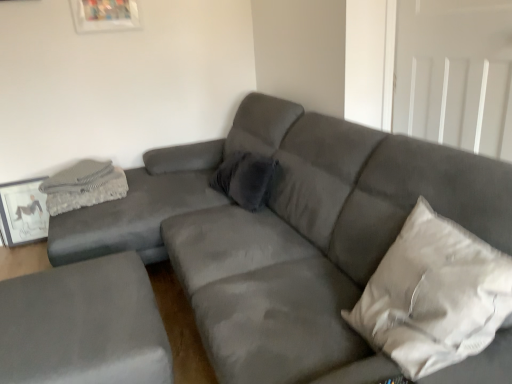
What is the approximate width of gray textured blanket at upper left?

20.87 inches.

Where is `matte gray picture frame at left`? matte gray picture frame at left is located at coordinates (23, 212).

Identify the location of white fabric pillow at right, the first pillow when ordered from right to left. The height and width of the screenshot is (384, 512). (434, 295).

Describe the element at coordinates (83, 325) in the screenshot. I see `suede gray ottoman at lower left, the 1th studio couch viewed from the left` at that location.

I want to click on gray textured blanket at upper left, so click(x=84, y=186).

Which is more to the left, matte gray picture frame at left or gray textured blanket at upper left?

matte gray picture frame at left.

Can you confirm if matte gray picture frame at left is taller than gray textured blanket at upper left?

Indeed, matte gray picture frame at left has a greater height compared to gray textured blanket at upper left.

Is matte gray picture frame at left located outside gray textured blanket at upper left?

Yes, matte gray picture frame at left is not within gray textured blanket at upper left.

How many degrees apart are the facing directions of matte gray picture frame at left and gray textured blanket at upper left?

matte gray picture frame at left and gray textured blanket at upper left are facing 90.4 degrees away from each other.

Is suede gray couch at center, the second studio couch when ordered from left to right, next to velvet gray pillow at center, positioned as the second pillow in front-to-back order?

No, suede gray couch at center, the second studio couch when ordered from left to right, is not making contact with velvet gray pillow at center, positioned as the second pillow in front-to-back order.

Locate an element on the screen. the 2nd studio couch in front of the velvet gray pillow at center, the first pillow in the back-to-front sequence is located at coordinates (287, 234).

Can you confirm if suede gray couch at center, positioned as the first studio couch in right-to-left order, is wider than velvet gray pillow at center, the first pillow from the left?

Yes.

Is point (120, 188) more distant than point (47, 220)?

No, (120, 188) is closer to viewer.

Is gray textured blanket at upper left situated inside matte gray picture frame at left or outside?

gray textured blanket at upper left is spatially situated outside matte gray picture frame at left.

Where is `picture frame that is on the left side of gray textured blanket at upper left`? picture frame that is on the left side of gray textured blanket at upper left is located at coordinates (23, 212).

Relative to suede gray ottoman at lower left, the 1th studio couch viewed from the left, is white fabric pillow at right, the first pillow when ordered from right to left, in front or behind?

Clearly, white fabric pillow at right, the first pillow when ordered from right to left, is in front of suede gray ottoman at lower left, the 1th studio couch viewed from the left.

How much distance is there between white fabric pillow at right, the 1th pillow from the front, and suede gray ottoman at lower left, the 1th studio couch viewed from the left?

white fabric pillow at right, the 1th pillow from the front, and suede gray ottoman at lower left, the 1th studio couch viewed from the left, are 36.00 inches apart.

From the image's perspective, is white fabric pillow at right, the 1th pillow from the front, above suede gray ottoman at lower left, the 1th studio couch viewed from the left?

Yes, from the image's perspective, white fabric pillow at right, the 1th pillow from the front, is above suede gray ottoman at lower left, the 1th studio couch viewed from the left.

Considering the sizes of white fabric pillow at right, the 2th pillow from the left, and suede gray ottoman at lower left, marked as the 2th studio couch in a right-to-left arrangement, in the image, is white fabric pillow at right, the 2th pillow from the left, wider or thinner than suede gray ottoman at lower left, marked as the 2th studio couch in a right-to-left arrangement,?

Clearly, white fabric pillow at right, the 2th pillow from the left, has less width compared to suede gray ottoman at lower left, marked as the 2th studio couch in a right-to-left arrangement.

In the image, is suede gray ottoman at lower left, the 1th studio couch viewed from the left, on the left side or the right side of suede gray couch at center, the second studio couch when ordered from left to right?

Clearly, suede gray ottoman at lower left, the 1th studio couch viewed from the left, is on the left of suede gray couch at center, the second studio couch when ordered from left to right, in the image.

Considering the sizes of suede gray ottoman at lower left, the 1th studio couch viewed from the left, and suede gray couch at center, positioned as the first studio couch in right-to-left order, in the image, is suede gray ottoman at lower left, the 1th studio couch viewed from the left, wider or thinner than suede gray couch at center, positioned as the first studio couch in right-to-left order,?

Considering their sizes, suede gray ottoman at lower left, the 1th studio couch viewed from the left, looks slimmer than suede gray couch at center, positioned as the first studio couch in right-to-left order.

How different are the orientations of suede gray ottoman at lower left, marked as the 2th studio couch in a right-to-left arrangement, and suede gray couch at center, positioned as the first studio couch in right-to-left order, in degrees?

The facing directions of suede gray ottoman at lower left, marked as the 2th studio couch in a right-to-left arrangement, and suede gray couch at center, positioned as the first studio couch in right-to-left order, are 1.32 degrees apart.

From the picture: Does suede gray ottoman at lower left, marked as the 2th studio couch in a right-to-left arrangement, have a smaller size compared to suede gray couch at center, positioned as the first studio couch in right-to-left order?

Yes, suede gray ottoman at lower left, marked as the 2th studio couch in a right-to-left arrangement, is smaller than suede gray couch at center, positioned as the first studio couch in right-to-left order.

Considering the relative sizes of suede gray couch at center, the second studio couch when ordered from left to right, and white fabric pillow at right, the second pillow positioned from the back, in the image provided, is suede gray couch at center, the second studio couch when ordered from left to right, taller than white fabric pillow at right, the second pillow positioned from the back,?

Yes.

Is suede gray couch at center, positioned as the first studio couch in right-to-left order, oriented towards white fabric pillow at right, the second pillow positioned from the back?

Yes, suede gray couch at center, positioned as the first studio couch in right-to-left order, is aimed at white fabric pillow at right, the second pillow positioned from the back.

Which is behind, suede gray couch at center, the second studio couch when ordered from left to right, or white fabric pillow at right, the first pillow when ordered from right to left?

white fabric pillow at right, the first pillow when ordered from right to left, is behind.

From a real-world perspective, does matte gray picture frame at left sit lower than suede gray couch at center, the second studio couch when ordered from left to right?

Yes.

Does point (25, 236) come closer to viewer compared to point (213, 326)?

No, (25, 236) is further to viewer.

Is matte gray picture frame at left next to suede gray couch at center, positioned as the first studio couch in right-to-left order, and touching it?

No, matte gray picture frame at left is not touching suede gray couch at center, positioned as the first studio couch in right-to-left order.

Which object is closer to the camera, matte gray picture frame at left or suede gray couch at center, the second studio couch when ordered from left to right?

suede gray couch at center, the second studio couch when ordered from left to right, is closer to the camera.

In order to click on picture frame lying below the gray textured blanket at upper left (from the image's perspective) in this screenshot , I will do `click(23, 212)`.

The height and width of the screenshot is (384, 512). I want to click on pillow on the left of the suede gray couch at center, the second studio couch when ordered from left to right, so click(x=247, y=179).

Looking at the image, which one is located closer to suede gray ottoman at lower left, the 1th studio couch viewed from the left, suede gray couch at center, the second studio couch when ordered from left to right, or matte gray picture frame at left?

suede gray couch at center, the second studio couch when ordered from left to right, is closer to suede gray ottoman at lower left, the 1th studio couch viewed from the left.

From the image, which object appears to be nearer to velvet gray pillow at center, which is the second pillow in right-to-left order, matte gray picture frame at left or gray textured blanket at upper left?

gray textured blanket at upper left is closer to velvet gray pillow at center, which is the second pillow in right-to-left order.

When comparing their distances from velvet gray pillow at center, the first pillow in the back-to-front sequence, does gray textured blanket at upper left or suede gray ottoman at lower left, marked as the 2th studio couch in a right-to-left arrangement, seem closer?

gray textured blanket at upper left lies closer to velvet gray pillow at center, the first pillow in the back-to-front sequence, than the other object.

Based on their spatial positions, is matte gray picture frame at left or suede gray couch at center, positioned as the first studio couch in right-to-left order, further from gray textured blanket at upper left?

The object further to gray textured blanket at upper left is suede gray couch at center, positioned as the first studio couch in right-to-left order.

Based on their spatial positions, is velvet gray pillow at center, the first pillow in the back-to-front sequence, or white fabric pillow at right, the 2th pillow from the left, closer to gray textured blanket at upper left?

Based on the image, velvet gray pillow at center, the first pillow in the back-to-front sequence, appears to be nearer to gray textured blanket at upper left.

Estimate the real-world distances between objects in this image. Which object is further from white fabric pillow at right, the 1th pillow from the front, matte gray picture frame at left or gray textured blanket at upper left?

Among the two, matte gray picture frame at left is located further to white fabric pillow at right, the 1th pillow from the front.

From the image, which object appears to be nearer to gray textured blanket at upper left, white fabric pillow at right, the second pillow positioned from the back, or suede gray ottoman at lower left, the 1th studio couch viewed from the left?

The object closer to gray textured blanket at upper left is suede gray ottoman at lower left, the 1th studio couch viewed from the left.

In the scene shown: Considering their positions, is suede gray ottoman at lower left, the 1th studio couch viewed from the left, positioned closer to gray textured blanket at upper left than white fabric pillow at right, the first pillow when ordered from right to left?

Among the two, suede gray ottoman at lower left, the 1th studio couch viewed from the left, is located nearer to gray textured blanket at upper left.

At what (x,y) coordinates should I click in order to perform the action: click on pillow between suede gray ottoman at lower left, marked as the 2th studio couch in a right-to-left arrangement, and gray textured blanket at upper left in the front-back direction. Please return your answer as a coordinate pair (x, y). The height and width of the screenshot is (384, 512). Looking at the image, I should click on (247, 179).

At what (x,y) coordinates should I click in order to perform the action: click on pillow between suede gray ottoman at lower left, marked as the 2th studio couch in a right-to-left arrangement, and matte gray picture frame at left in the front-back direction. Please return your answer as a coordinate pair (x, y). The width and height of the screenshot is (512, 384). Looking at the image, I should click on (247, 179).

At what (x,y) coordinates should I click in order to perform the action: click on pillow between suede gray couch at center, the second studio couch when ordered from left to right, and velvet gray pillow at center, which is the second pillow in right-to-left order, from front to back. Please return your answer as a coordinate pair (x, y). This screenshot has width=512, height=384. Looking at the image, I should click on (434, 295).

The image size is (512, 384). I want to click on studio couch between suede gray couch at center, the second studio couch when ordered from left to right, and velvet gray pillow at center, the first pillow from the left, in the front-back direction, so click(x=83, y=325).